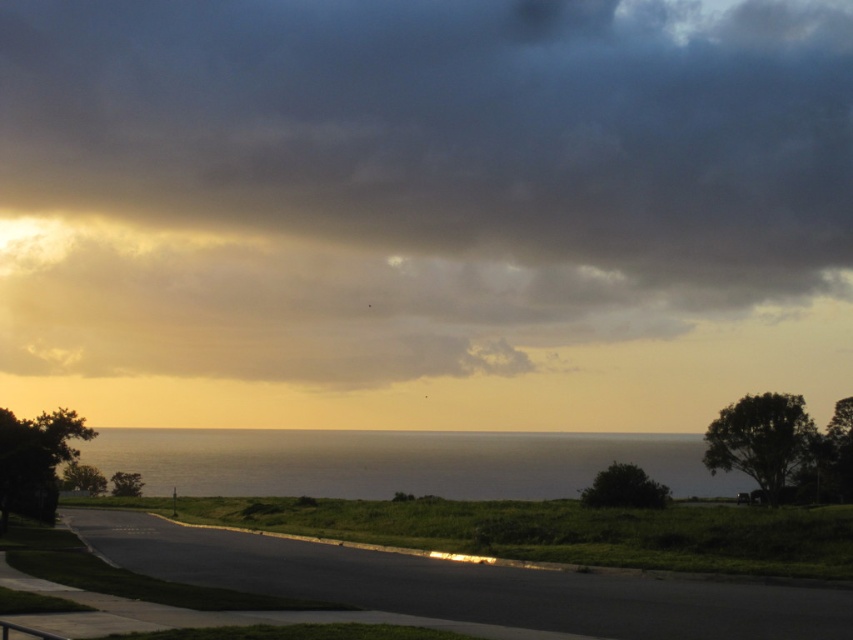
You are standing on the road in the foreground of the coastal scene. You want to take a photo of the olive green water at center without the dark gray cloud at upper center blocking the view. Where should you move relative to your current position?

You should move to the right side of the road because the dark gray cloud at upper center is closer to you than the olive green water at center. By moving right, you can position yourself so the cloud is no longer in front of the water.

You are standing on the paved road in the coastal scene, and you see two points marked in the image. One is at point (222,196) and the other at point (407,449). Which point is closer to you?

Point (222,196) is further to the camera than point (407,449), so the point at (407,449) is closer to you.